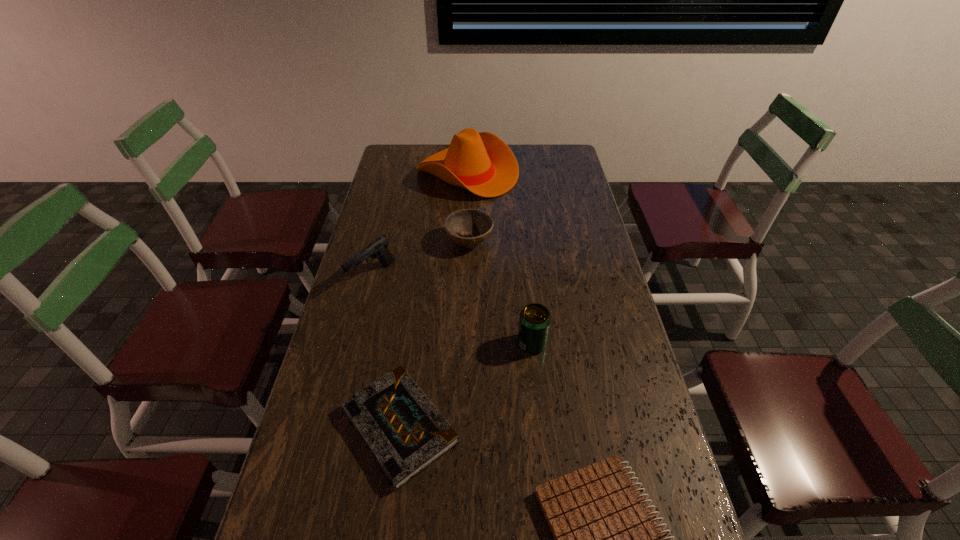
Image resolution: width=960 pixels, height=540 pixels. I want to click on free point at the far left corner, so (x=415, y=163).

This screenshot has width=960, height=540. What are the coordinates of `blank area at the far right corner` in the screenshot? It's located at (572, 164).

You are a GUI agent. You are given a task and a screenshot of the screen. Output one action in this format:
    pyautogui.click(x=<x>, y=<y>)
    Task: Click on the free space between the fifth tallest object and the gun
    The width and height of the screenshot is (960, 540).
    Given the screenshot: What is the action you would take?
    pyautogui.click(x=386, y=351)

Where is `free spot between the gun and the third nearest object`? Image resolution: width=960 pixels, height=540 pixels. free spot between the gun and the third nearest object is located at coordinates (452, 309).

Locate an element on the screen. unoccupied area between the taller notebook and the third shortest object is located at coordinates point(434,334).

Image resolution: width=960 pixels, height=540 pixels. I want to click on free spot between the left notebook and the third farthest object, so click(386, 351).

Identify the location of the second closest object to the gun. Image resolution: width=960 pixels, height=540 pixels. (405, 433).

Find the location of a particular element. The height and width of the screenshot is (540, 960). object that stands as the closest to the taller notebook is located at coordinates point(535,319).

Image resolution: width=960 pixels, height=540 pixels. Find the location of `vacant space that satisfies the following two spatial constraints: 1. on the front side of the beer can; 2. on the right side of the bowl`. vacant space that satisfies the following two spatial constraints: 1. on the front side of the beer can; 2. on the right side of the bowl is located at coordinates (467, 343).

I want to click on vacant space that satisfies the following two spatial constraints: 1. at the muzzle of the gun; 2. on the left side of the fifth tallest object, so click(335, 426).